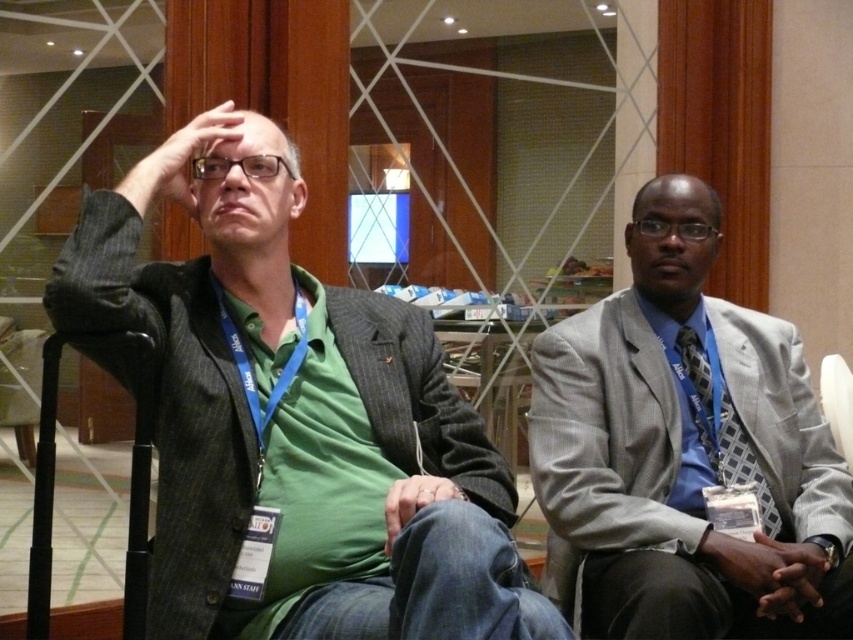
Can you confirm if gray textured suit at right is positioned to the right of blue checkered tie at right?

No, gray textured suit at right is not to the right of blue checkered tie at right.

Between point (624, 584) and point (732, 440), which one is positioned in front?

Positioned in front is point (624, 584).

This screenshot has width=853, height=640. Identify the location of gray textured suit at right. (683, 451).

Does green fabric shirt at left appear over gray textured suit at right?

Correct, green fabric shirt at left is located above gray textured suit at right.

Does point (340, 289) come farther from viewer compared to point (726, 305)?

No, (340, 289) is in front of (726, 305).

Is point (68, 282) more distant than point (630, 552)?

No, it is not.

Image resolution: width=853 pixels, height=640 pixels. What are the coordinates of `green fabric shirt at left` in the screenshot? It's located at (294, 419).

Is green fabric shirt at left to the left of blue checkered tie at right from the viewer's perspective?

Yes, green fabric shirt at left is to the left of blue checkered tie at right.

Find the location of a particular element. green fabric shirt at left is located at coordinates (294, 419).